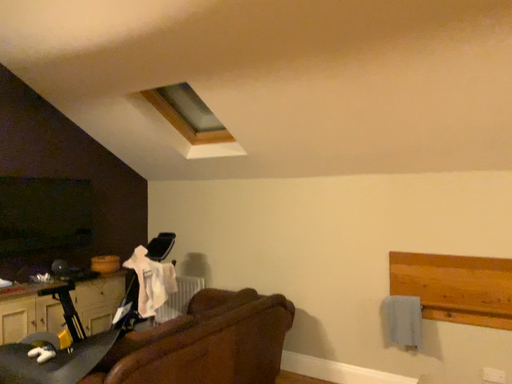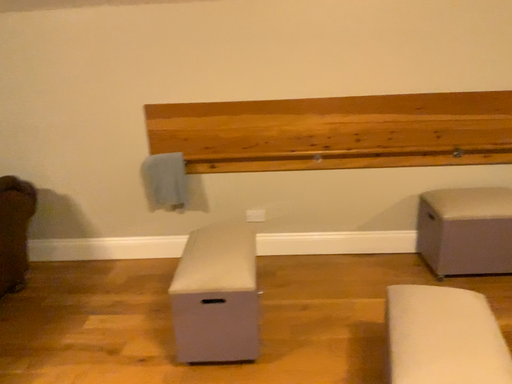
Question: How did the camera likely rotate when shooting the video?

Choices:
 (A) rotated right
 (B) rotated left

Answer: (A)